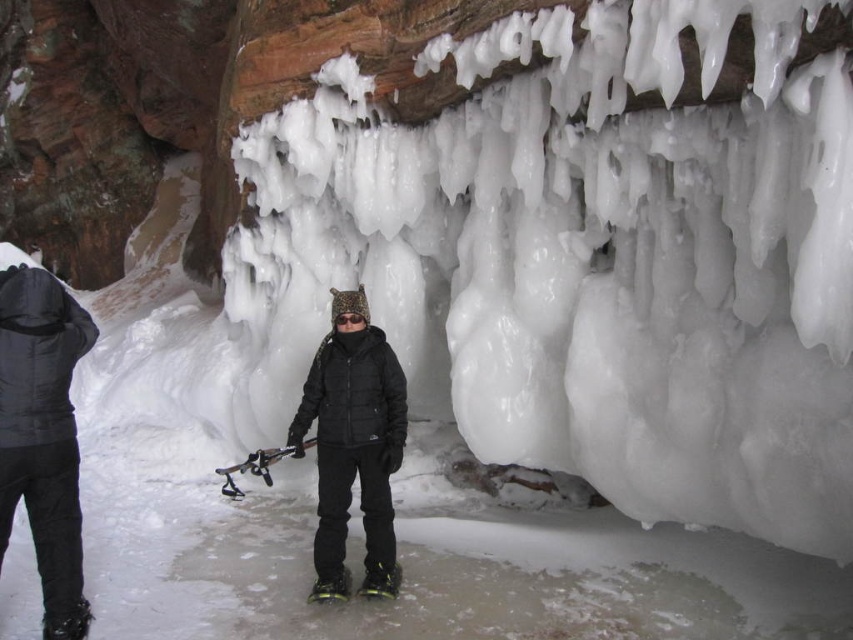
Question: Is black matte jacket at left smaller than black matte jacket at center?

Choices:
 (A) no
 (B) yes

Answer: (B)

Question: Is black matte jacket at left below black matte jacket at center?

Choices:
 (A) no
 (B) yes

Answer: (A)

Question: Is black matte jacket at left below black matte jacket at center?

Choices:
 (A) yes
 (B) no

Answer: (B)

Question: Among these points, which one is farthest from the camera?

Choices:
 (A) (53, 604)
 (B) (306, 400)

Answer: (B)

Question: Which point is farther to the camera?

Choices:
 (A) (387, 444)
 (B) (50, 276)

Answer: (A)